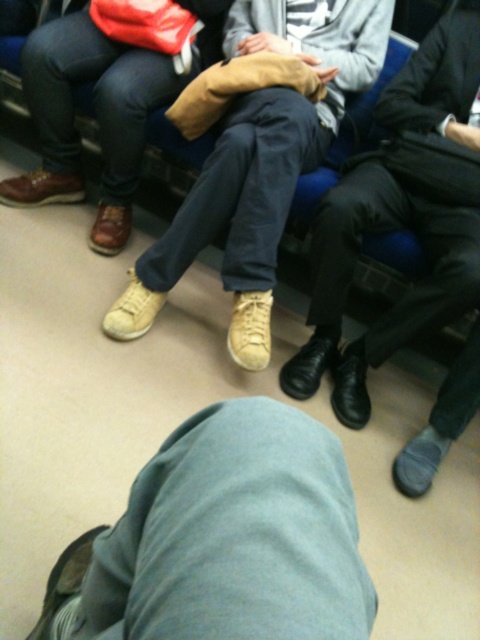
You are a photographer trying to capture a closeup of the leather shoes at center and tan suede shoes at center in the image. Which pair should you focus on first to ensure they are both in focus?

The leather shoes at center is closer to the viewer than the tan suede shoes at center, so you should focus on the leather shoes at center first to ensure both are in focus.

You are a photographer trying to capture a closeup of the leather shoes at center and the leather sneakers at center. Since you want to focus on the shoes, which one should you zoom in on first based on their size in the photo?

The leather shoes at center is taller than the leather sneakers at center, so you should zoom in on the leather shoes at center first because it appears larger in the photo.

Where is the leather shoes at center located in the image?

The leather shoes at center is located at point (400, 216) in the image.